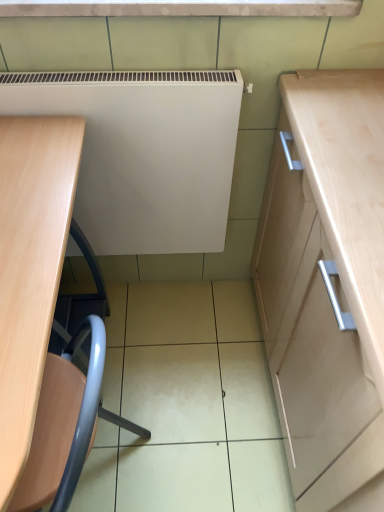
Question: Could you tell me if metallic blue swivel chair at lower left is facing white matte radiator at center?

Choices:
 (A) no
 (B) yes

Answer: (A)

Question: Is metallic blue swivel chair at lower left positioned far away from white matte radiator at center?

Choices:
 (A) no
 (B) yes

Answer: (A)

Question: Does metallic blue swivel chair at lower left touch white matte radiator at center?

Choices:
 (A) no
 (B) yes

Answer: (A)

Question: Is metallic blue swivel chair at lower left positioned with its back to white matte radiator at center?

Choices:
 (A) yes
 (B) no

Answer: (B)

Question: Is metallic blue swivel chair at lower left further to camera compared to white matte radiator at center?

Choices:
 (A) yes
 (B) no

Answer: (B)

Question: Looking at the image, does metallic blue swivel chair at lower left seem bigger or smaller compared to light wood desk at left?

Choices:
 (A) small
 (B) big

Answer: (A)

Question: From a real-world perspective, is metallic blue swivel chair at lower left above or below light wood desk at left?

Choices:
 (A) above
 (B) below

Answer: (B)

Question: Is metallic blue swivel chair at lower left taller or shorter than light wood desk at left?

Choices:
 (A) tall
 (B) short

Answer: (B)

Question: In the image, is metallic blue swivel chair at lower left on the left side or the right side of light wood desk at left?

Choices:
 (A) left
 (B) right

Answer: (B)

Question: Does point (177, 197) appear closer or farther from the camera than point (64, 424)?

Choices:
 (A) farther
 (B) closer

Answer: (A)

Question: Relative to metallic blue swivel chair at lower left, is white matte radiator at center in front or behind?

Choices:
 (A) behind
 (B) front

Answer: (A)

Question: From the image's perspective, is white matte radiator at center located above or below metallic blue swivel chair at lower left?

Choices:
 (A) below
 (B) above

Answer: (B)

Question: Visually, is white matte radiator at center positioned to the left or to the right of metallic blue swivel chair at lower left?

Choices:
 (A) left
 (B) right

Answer: (B)

Question: In terms of size, does light wood desk at left appear bigger or smaller than metallic blue swivel chair at lower left?

Choices:
 (A) small
 (B) big

Answer: (B)

Question: Is light wood desk at left wider or thinner than metallic blue swivel chair at lower left?

Choices:
 (A) thin
 (B) wide

Answer: (B)